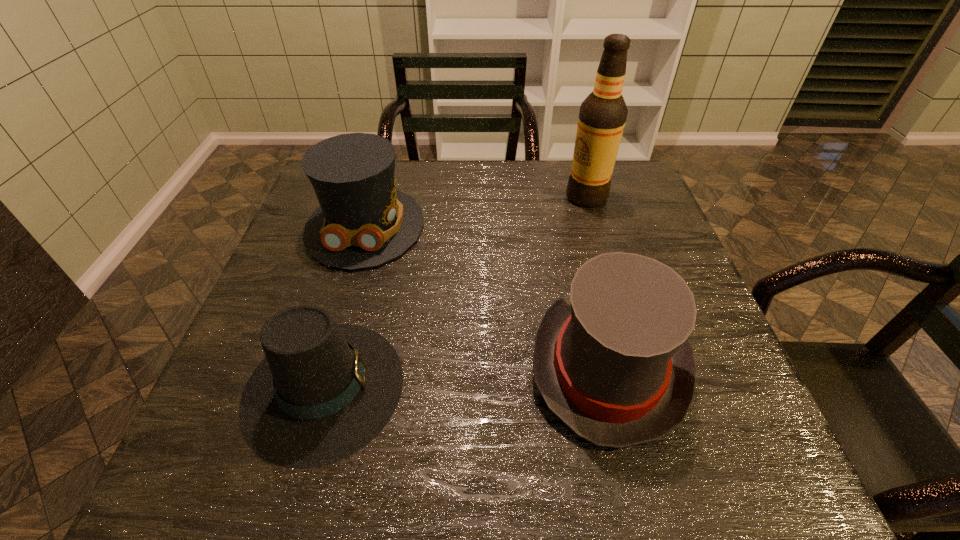
Find the location of a particular element. the closest hat to the rightmost hat is located at coordinates (324, 391).

Where is `hat that is the closest to the farthest hat`? This screenshot has width=960, height=540. hat that is the closest to the farthest hat is located at coordinates (324, 391).

At what (x,y) coordinates should I click in order to perform the action: click on vacant point that satisfies the following two spatial constraints: 1. on the label of the alcohol; 2. with goggles on the front of the farthest hat. Please return your answer as a coordinate pair (x, y). Looking at the image, I should click on (595, 226).

You are a GUI agent. You are given a task and a screenshot of the screen. Output one action in this format:
    pyautogui.click(x=<x>, y=<y>)
    Task: Click on the vacant region that satisfies the following two spatial constraints: 1. on the label of the alcohol; 2. on the front side of the rightmost hat
    Image resolution: width=960 pixels, height=540 pixels.
    Given the screenshot: What is the action you would take?
    pyautogui.click(x=636, y=366)

Locate an element on the screen. blank space that satisfies the following two spatial constraints: 1. on the label of the tallest object; 2. with goggles on the front of the farthest hat is located at coordinates (595, 226).